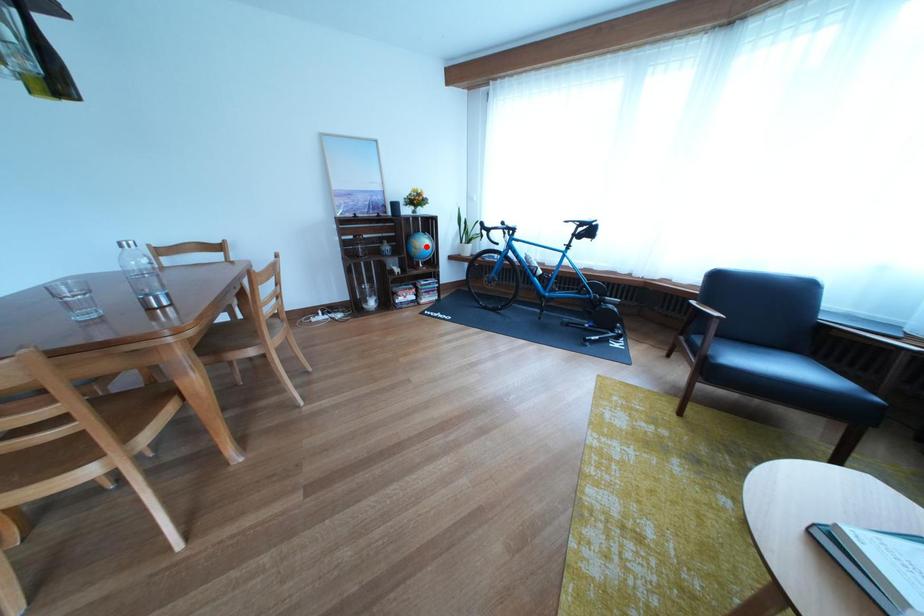
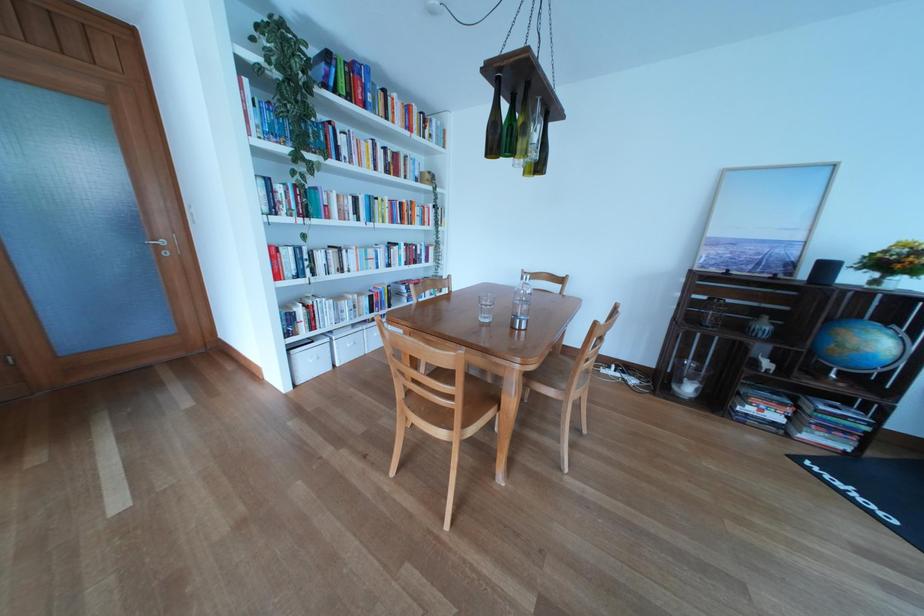
In the second image, find the point that corresponds to the highlighted location in the first image.

(855, 337)